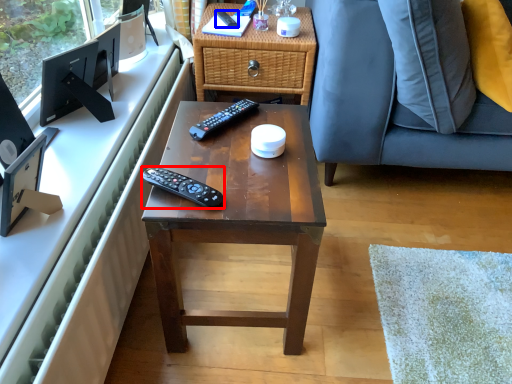
Question: Which object is closer to the camera taking this photo, remote control (highlighted by a red box) or remote control (highlighted by a blue box)?

Choices:
 (A) remote control
 (B) remote control

Answer: (A)